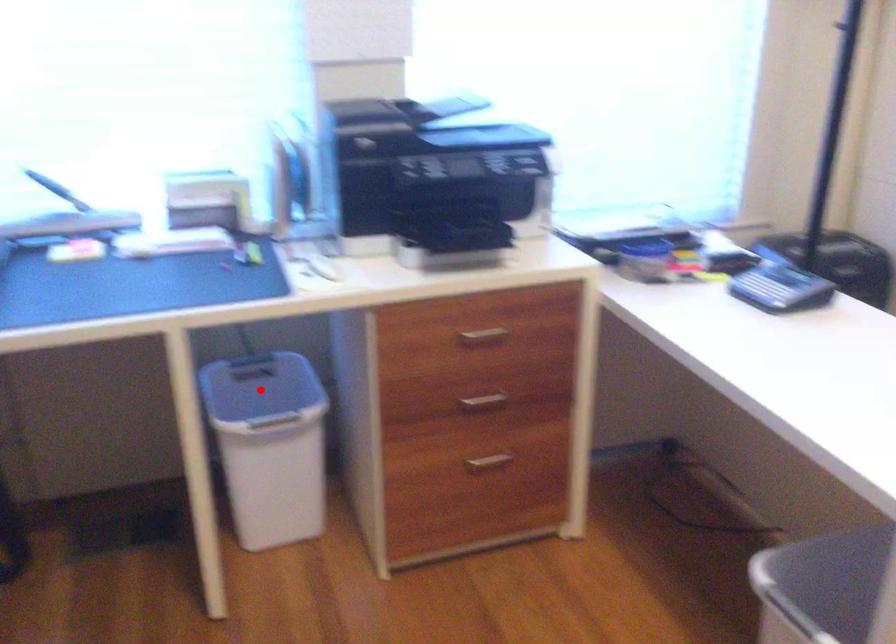
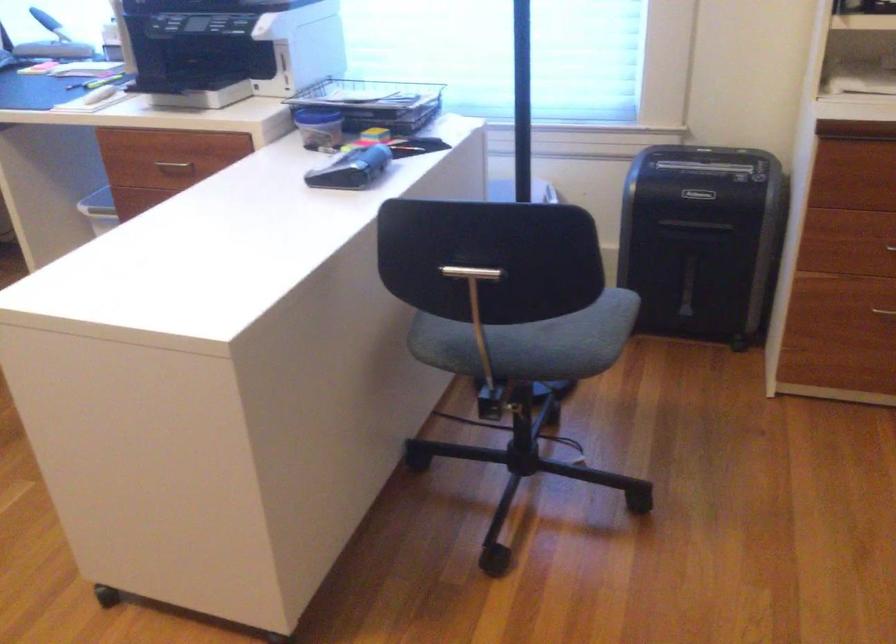
Question: I am providing you with two images of the same scene from different viewpoints. A red point is marked on the first image. Can you still see the location of the red point in image 2?

Choices:
 (A) Yes
 (B) No

Answer: (B)